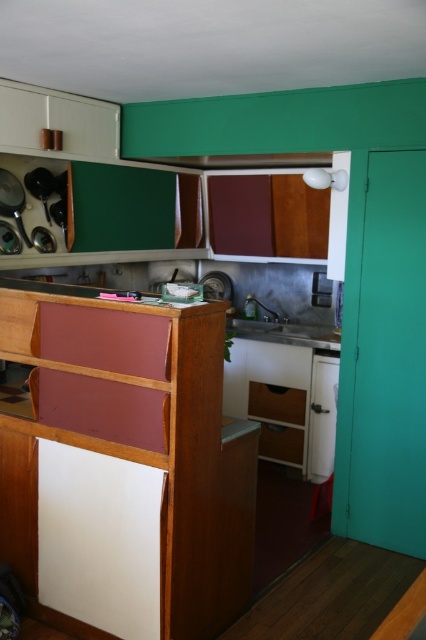
Question: Which object appears farthest from the camera in this image?

Choices:
 (A) wooden drawer at center
 (B) satin silver sink at center

Answer: (A)

Question: Which object is closer to the camera taking this photo?

Choices:
 (A) matte wood drawer at center
 (B) satin silver sink at center

Answer: (B)

Question: Does matte wood drawer at center have a lesser width compared to wooden drawer at center?

Choices:
 (A) no
 (B) yes

Answer: (A)

Question: Does matte wood drawer at center appear on the right side of wooden drawer at center?

Choices:
 (A) yes
 (B) no

Answer: (B)

Question: Can you confirm if satin silver sink at center is wider than wooden drawer at center?

Choices:
 (A) no
 (B) yes

Answer: (B)

Question: Which of these objects is positioned farthest from the satin silver sink at center?

Choices:
 (A) wooden drawer at center
 (B) matte wood drawer at center

Answer: (A)